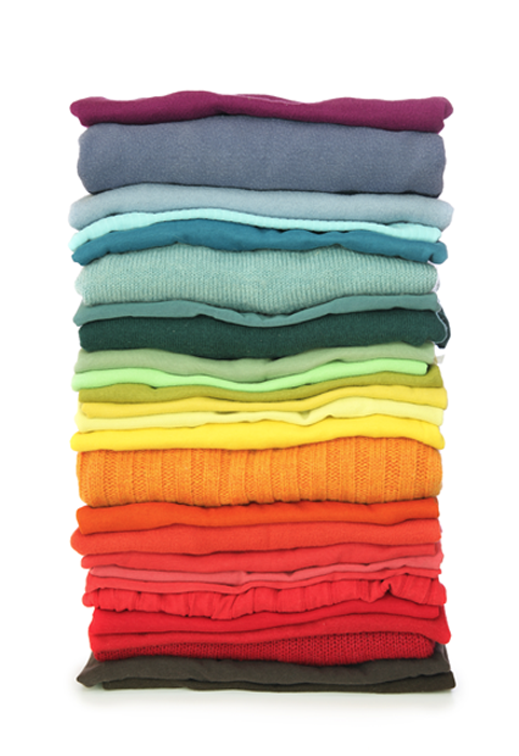
Identify the location of red cloth. The height and width of the screenshot is (756, 519). (322, 649), (336, 626), (266, 618), (260, 599), (208, 589), (235, 578), (260, 562), (258, 541).